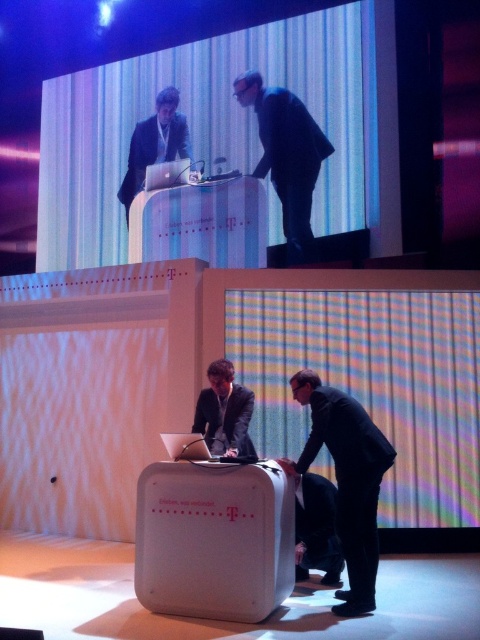
Can you confirm if black matte suit at lower center is positioned to the right of matte black suit at upper center?

Correct, you'll find black matte suit at lower center to the right of matte black suit at upper center.

Does black matte suit at lower center have a lesser width compared to matte black suit at upper center?

Indeed, black matte suit at lower center has a lesser width compared to matte black suit at upper center.

Who is more distant from viewer, (354, 442) or (184, 116)?

The point (184, 116) is more distant.

I want to click on black matte suit at lower center, so click(348, 480).

Who is taller, black matte suit at center or dark gray suit at center?

black matte suit at center

Does point (269, 97) come in front of point (225, 396)?

No, it is behind (225, 396).

Does point (305, 154) lie in front of point (229, 429)?

No, it is not.

Where is `black matte suit at center`? black matte suit at center is located at coordinates (289, 156).

Can you confirm if black matte suit at lower center is bigger than black matte suit at center?

Actually, black matte suit at lower center might be smaller than black matte suit at center.

Is point (384, 451) behind point (307, 195)?

No, it is not.

Does point (372, 452) come closer to viewer compared to point (296, 156)?

Yes.

Locate an element on the screen. black matte suit at lower center is located at coordinates (348, 480).